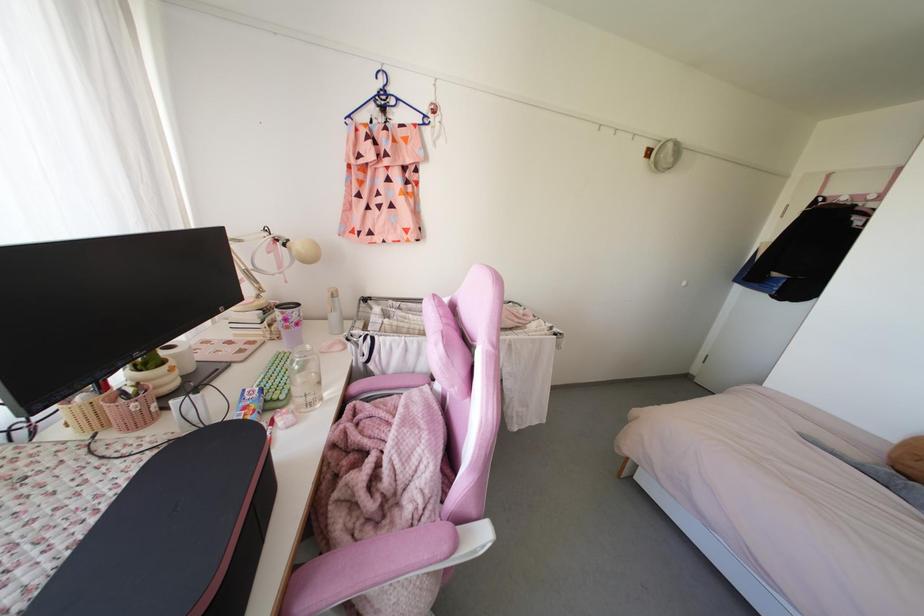
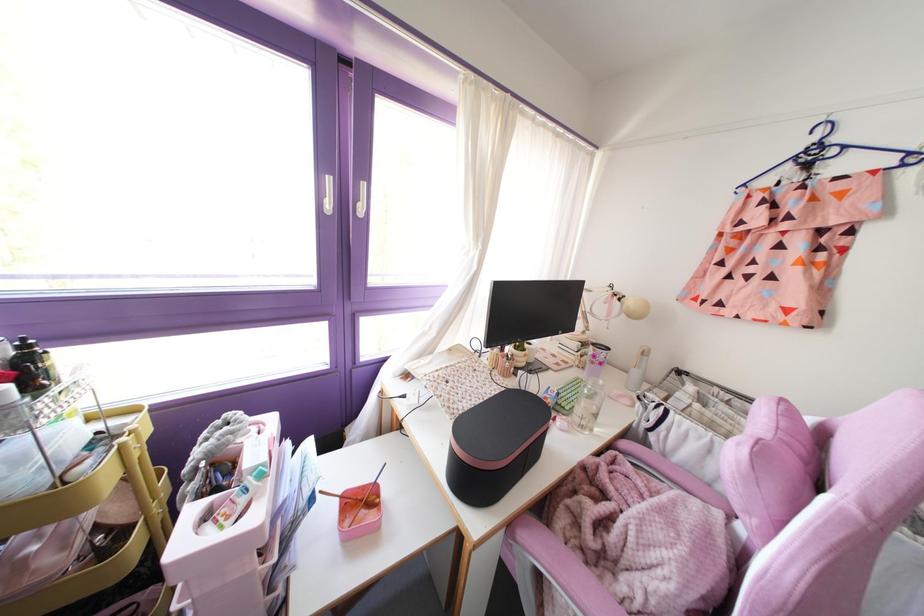
Where in the second image is the point corresponding to point 307,346 from the first image?

(601, 382)